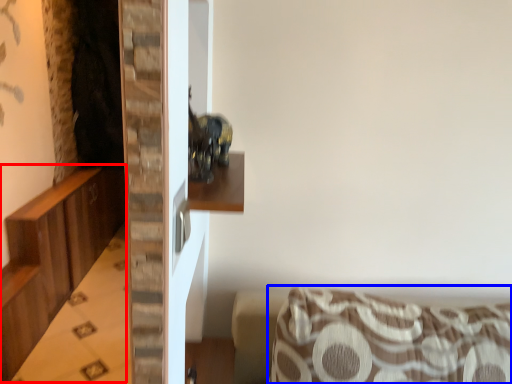
Question: Which object is further to the camera taking this photo, dresser (highlighted by a red box) or furniture (highlighted by a blue box)?

Choices:
 (A) dresser
 (B) furniture

Answer: (A)